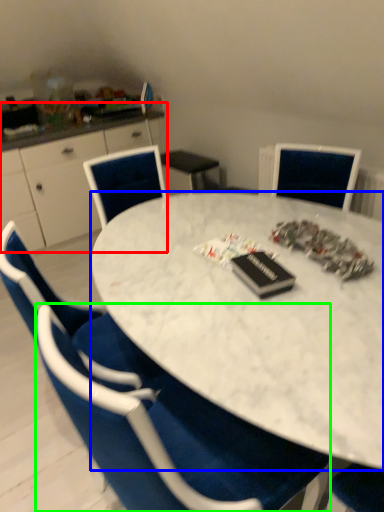
Question: Considering the real-world distances, which object is closest to computer desk (highlighted by a red box)? desk (highlighted by a blue box) or chair (highlighted by a green box).

Choices:
 (A) desk
 (B) chair

Answer: (A)